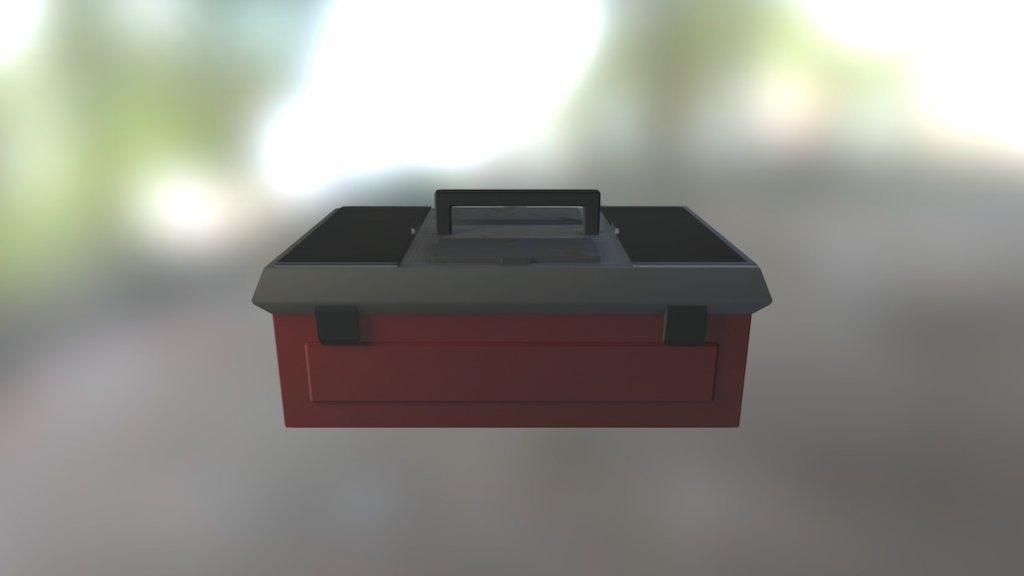
Identify the location of handle. The height and width of the screenshot is (576, 1024). (563, 194).